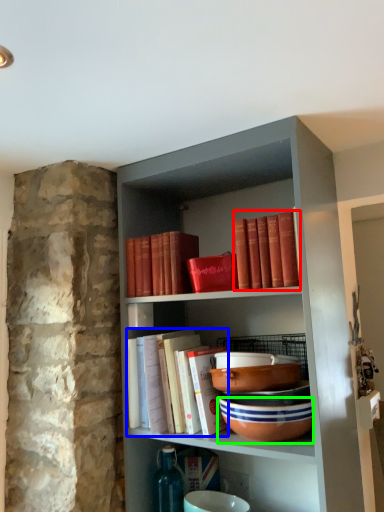
Question: Based on their relative distances, which object is farther from book (highlighted by a red box)? Choose from book (highlighted by a blue box) and bowl (highlighted by a green box).

Choices:
 (A) book
 (B) bowl

Answer: (A)